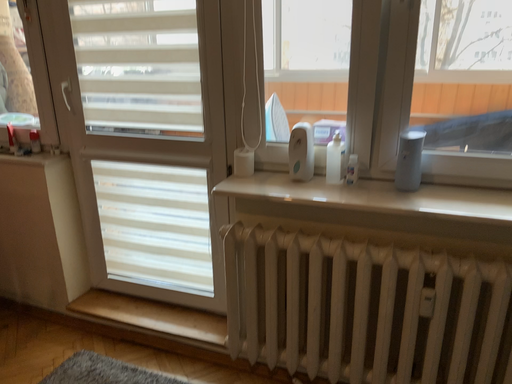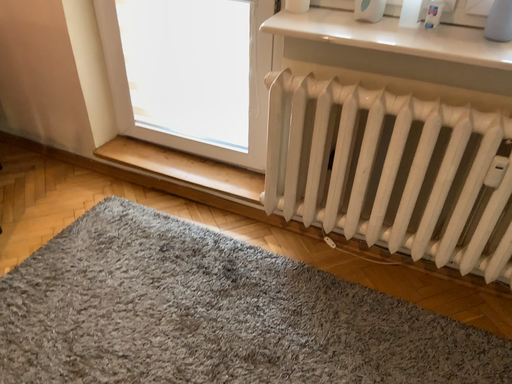
Question: Which way did the camera rotate in the video?

Choices:
 (A) rotated downward
 (B) rotated upward

Answer: (A)